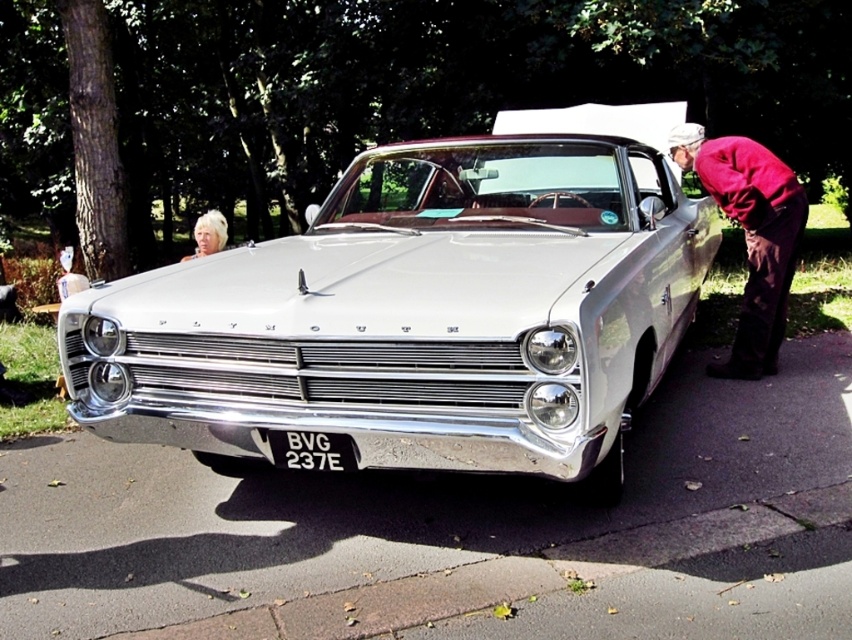
Does white metallic car at center have a lesser width compared to blonde hair at upper left?

No, white metallic car at center is not thinner than blonde hair at upper left.

Can you confirm if white metallic car at center is shorter than blonde hair at upper left?

No, white metallic car at center is not shorter than blonde hair at upper left.

Image resolution: width=852 pixels, height=640 pixels. What do you see at coordinates (416, 316) in the screenshot?
I see `white metallic car at center` at bounding box center [416, 316].

You are a GUI agent. You are given a task and a screenshot of the screen. Output one action in this format:
    pyautogui.click(x=<x>, y=<y>)
    Task: Click on the white metallic car at center
    
    Given the screenshot: What is the action you would take?
    pyautogui.click(x=416, y=316)

Which is more to the left, maroon fabric coat at right or blonde hair at upper left?

blonde hair at upper left is more to the left.

Looking at this image, who is shorter, maroon fabric coat at right or blonde hair at upper left?

blonde hair at upper left is shorter.

The image size is (852, 640). What do you see at coordinates (750, 236) in the screenshot?
I see `maroon fabric coat at right` at bounding box center [750, 236].

Image resolution: width=852 pixels, height=640 pixels. I want to click on maroon fabric coat at right, so click(x=750, y=236).

Can you confirm if maroon fabric coat at right is positioned below black plastic license plate at center?

No, maroon fabric coat at right is not below black plastic license plate at center.

In the scene shown: Does maroon fabric coat at right come in front of black plastic license plate at center?

No, maroon fabric coat at right is behind black plastic license plate at center.

In order to click on maroon fabric coat at right in this screenshot , I will do `click(750, 236)`.